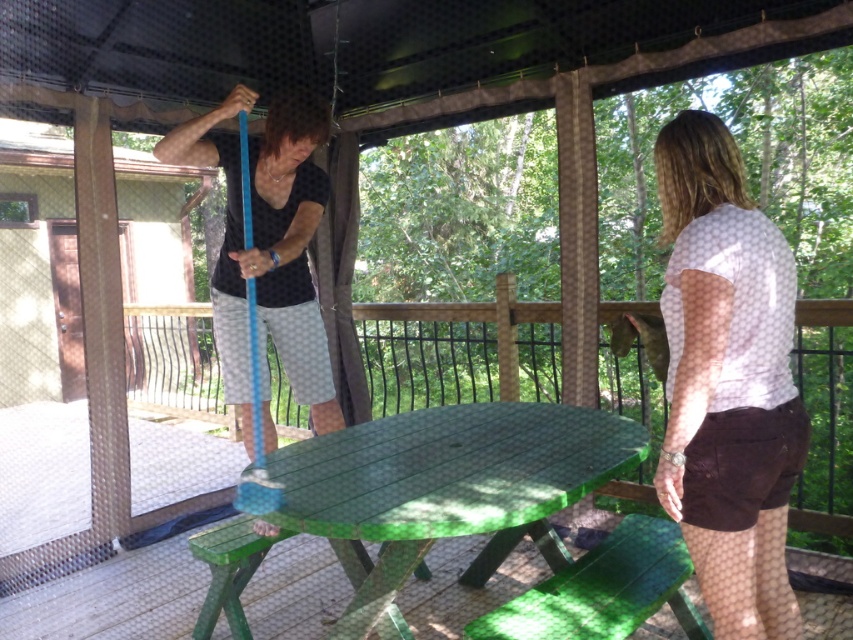
You are planning to place a large rectangular board game on the green wood picnic table at center and the green painted wood table at center. Which table do you think will accommodate the board game better?

The green painted wood table at center has a greater width than the green wood picnic table at center, so it can accommodate the board game better.

You are standing on the wooden deck and want to place a small plant pot between the two points labeled as point (199, 570) and point (708, 412). Which point should the pot be closer to in order to be nearer to the camera?

The small plant pot should be placed closer to point (199, 570) because it is further to the camera than point (708, 412).

You are standing on the wooden deck and want to place a small potted plant between the white dotted shirt at center and the green painted wood table at center. Based on their positions, which object should the plant be closer to?

The white dotted shirt at center is to the right of the green painted wood table at center, so the plant should be placed closer to the green painted wood table at center to be between them.